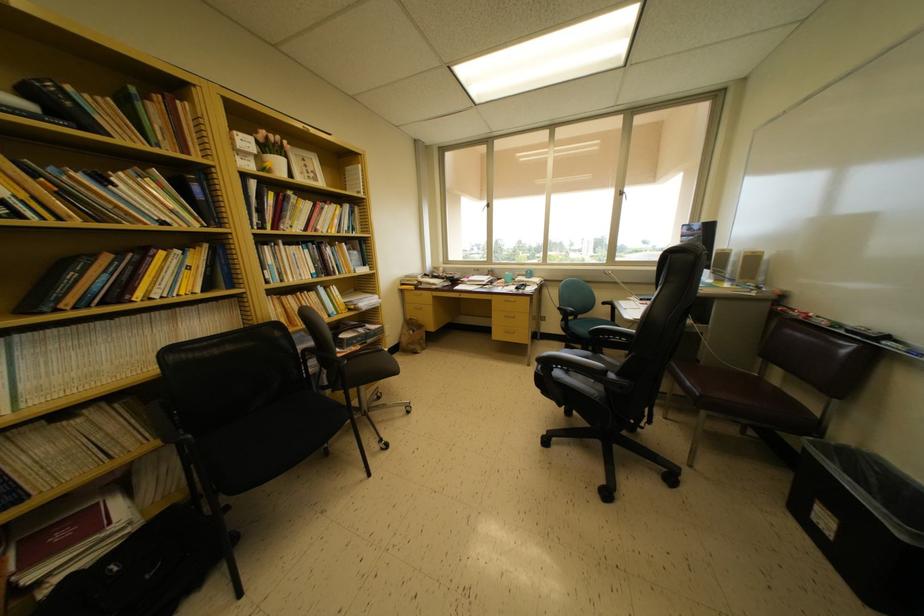
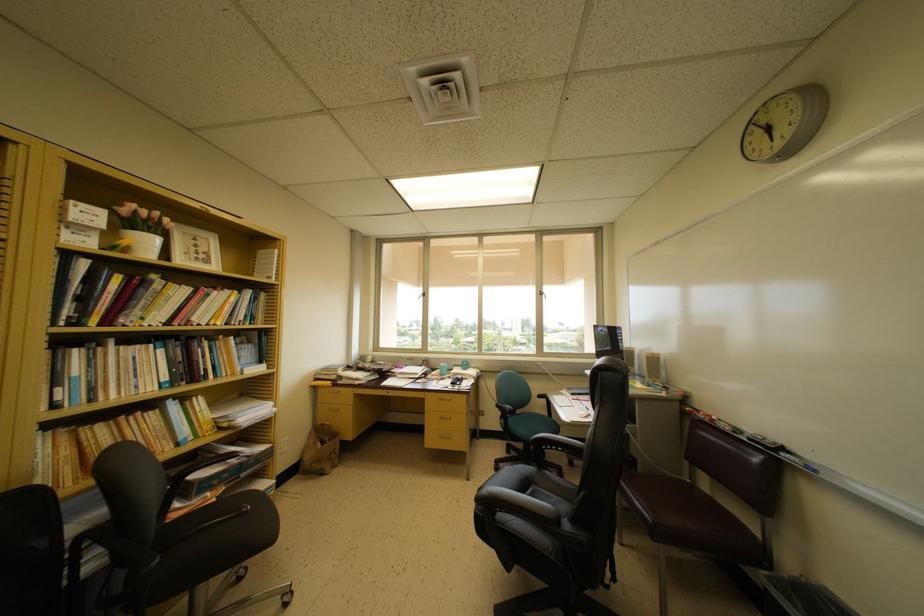
The point at (625, 196) is marked in the first image. Where is the corresponding point in the second image?

(543, 297)